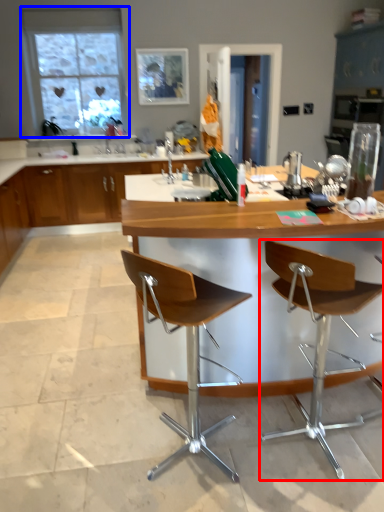
Question: Which point is further to the camera, chair (highlighted by a red box) or window (highlighted by a blue box)?

Choices:
 (A) chair
 (B) window

Answer: (B)